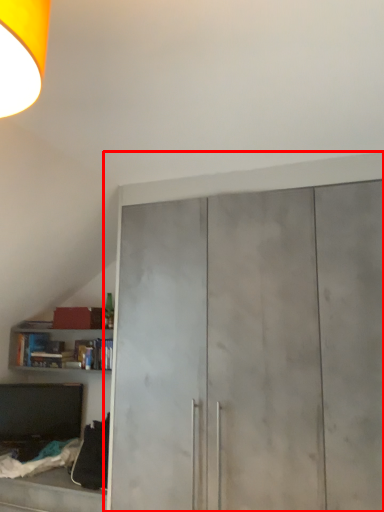
Question: From the image's perspective, where is cupboard (annotated by the red box) located relative to cabinetry?

Choices:
 (A) above
 (B) below

Answer: (A)